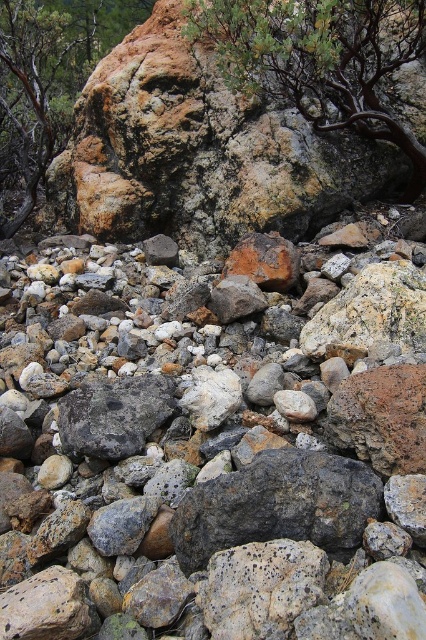
Question: Among these objects, which one is nearest to the camera?

Choices:
 (A) speckled stone at center
 (B) smooth brown tree trunk at upper center

Answer: (A)

Question: Which of the following is the closest to the observer?

Choices:
 (A) speckled stone at center
 (B) green textured rock at upper center
 (C) gray rough rock at center

Answer: (A)

Question: Is smooth brown tree trunk at upper center smaller than green textured rock at upper center?

Choices:
 (A) no
 (B) yes

Answer: (B)

Question: Considering the relative positions of speckled stone at center and green textured rock at upper center in the image provided, where is speckled stone at center located with respect to green textured rock at upper center?

Choices:
 (A) above
 (B) below

Answer: (B)

Question: Which of the following is the farthest from the observer?

Choices:
 (A) green textured rock at upper center
 (B) speckled stone at center
 (C) gray rough rock at center
 (D) smooth brown tree trunk at upper center

Answer: (A)

Question: Is speckled stone at center further to the viewer compared to gray rough rock at center?

Choices:
 (A) no
 (B) yes

Answer: (A)